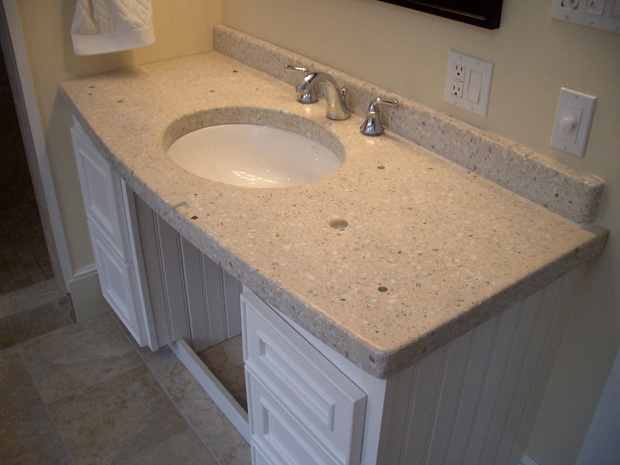
Where is `backsplash right of sink`? backsplash right of sink is located at coordinates [470, 152].